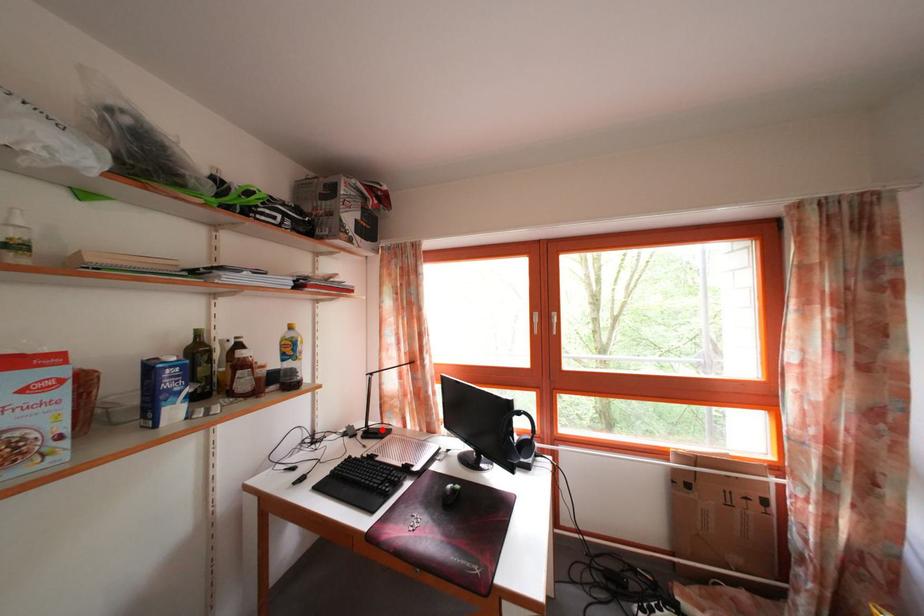
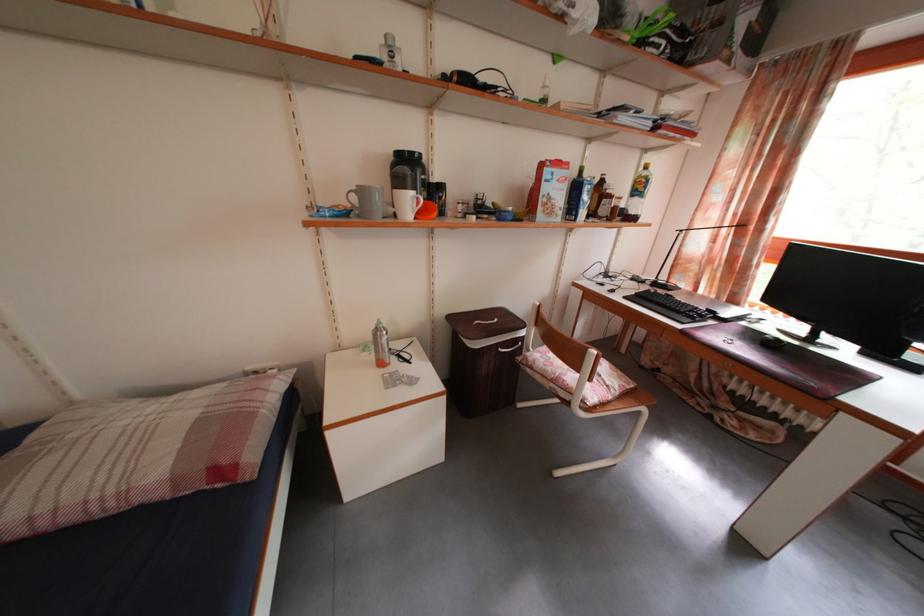
Question: I am providing you with two images of the same scene from different viewpoints. Given a red point in image1, look at the same physical point in image2. Is it:

Choices:
 (A) Closer to the viewpoint
 (B) Farther from the viewpoint

Answer: (A)